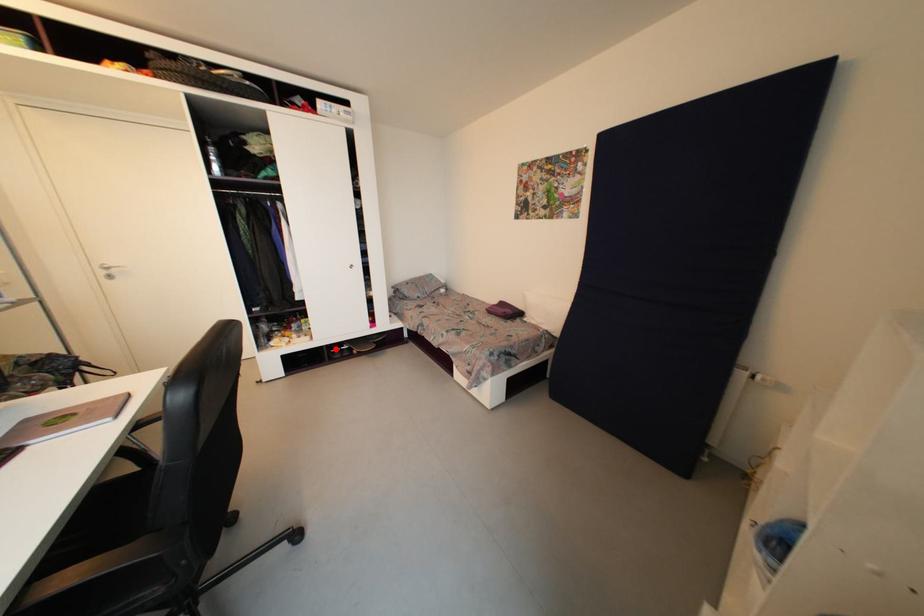
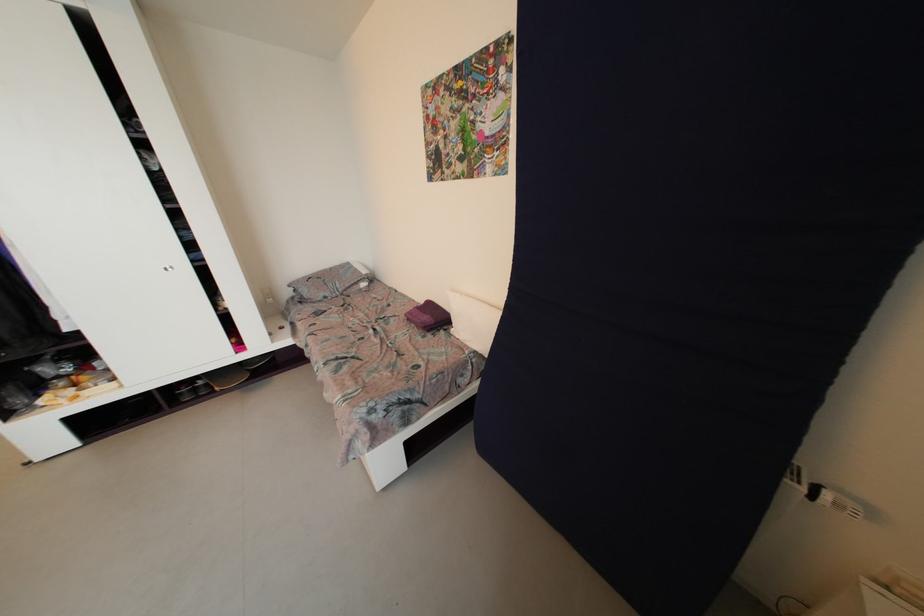
Question: I am providing you with two images of the same scene from different viewpoints. In image1, a red point is highlighted. Considering the same 3D point in image2, which of the following is correct?

Choices:
 (A) It is closer
 (B) It is farther

Answer: (A)